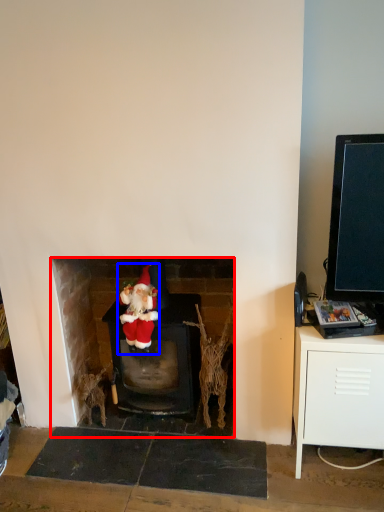
Question: Which of the following is the farthest to the observer, fireplace (highlighted by a red box) or person (highlighted by a blue box)?

Choices:
 (A) fireplace
 (B) person

Answer: (A)